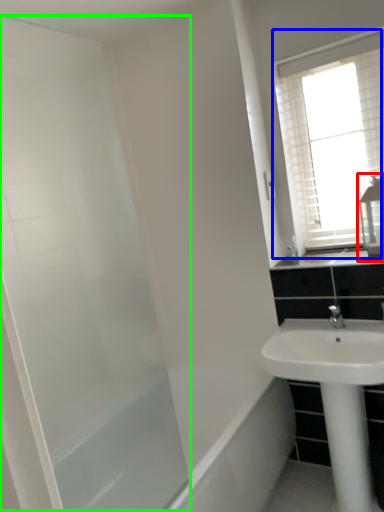
Question: Considering the real-world distances, which object is farthest from medicine cabinet (highlighted by a red box)? window (highlighted by a blue box) or screen door (highlighted by a green box)?

Choices:
 (A) window
 (B) screen door

Answer: (B)